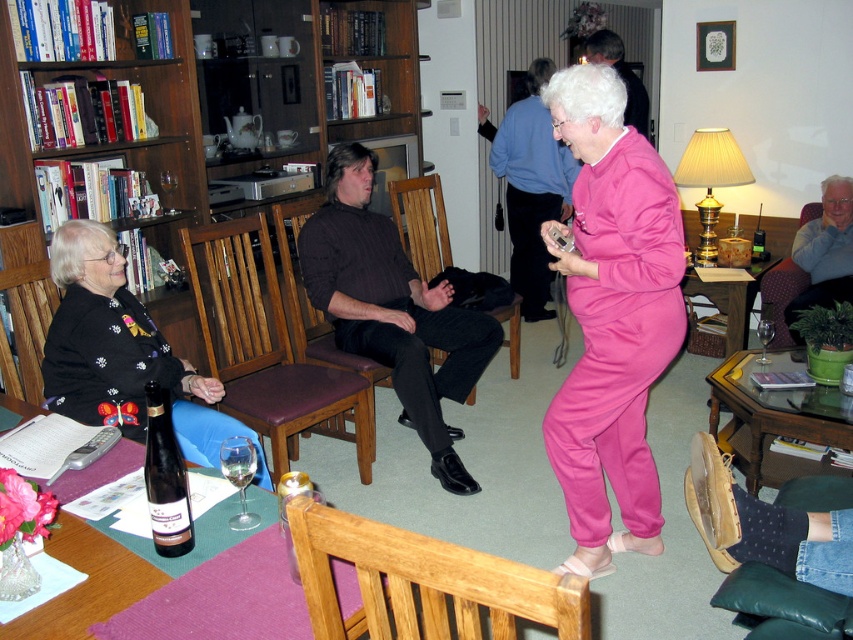
Who is shorter, brown glass bottle at lower left or wooden armchair at left?

brown glass bottle at lower left is shorter.

Which is more to the right, brown glass bottle at lower left or wooden armchair at left?

Positioned to the right is brown glass bottle at lower left.

Is point (164, 465) positioned after point (16, 324)?

No, (164, 465) is in front of (16, 324).

The image size is (853, 640). I want to click on brown glass bottle at lower left, so click(165, 477).

Does point (767, 406) come behind point (625, 106)?

No, (767, 406) is in front of (625, 106).

Is point (825, 400) in front of point (625, 72)?

Yes.

Between point (726, 436) and point (614, 42), which one is positioned behind?

The point (614, 42) is more distant.

Where is `glassmaterial/texturetable at lower center`? This screenshot has width=853, height=640. glassmaterial/texturetable at lower center is located at coordinates (773, 419).

What do you see at coordinates (392, 308) in the screenshot? I see `black smooth shirt at center` at bounding box center [392, 308].

Based on the photo, who is positioned more to the left, black smooth shirt at center or wooden bookshelf at upper left?

From the viewer's perspective, wooden bookshelf at upper left appears more on the left side.

Locate an element on the screen. This screenshot has height=640, width=853. black smooth shirt at center is located at coordinates (392, 308).